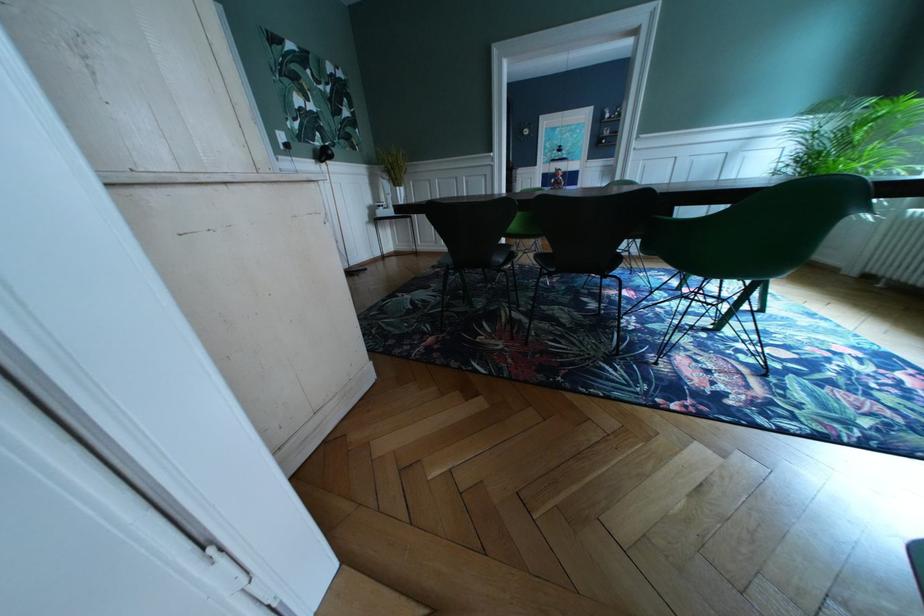
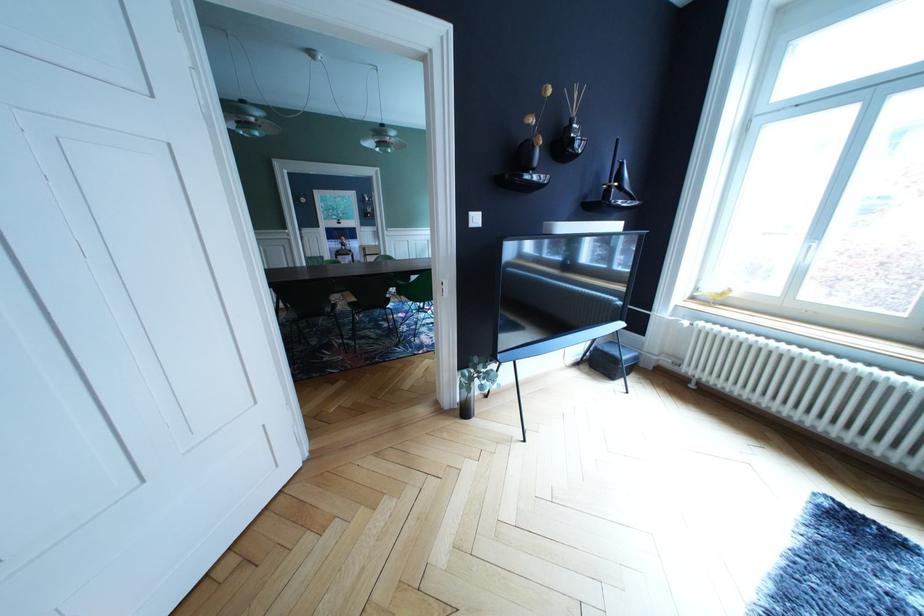
The point at (508,277) is marked in the first image. Where is the corresponding point in the second image?

(338, 322)